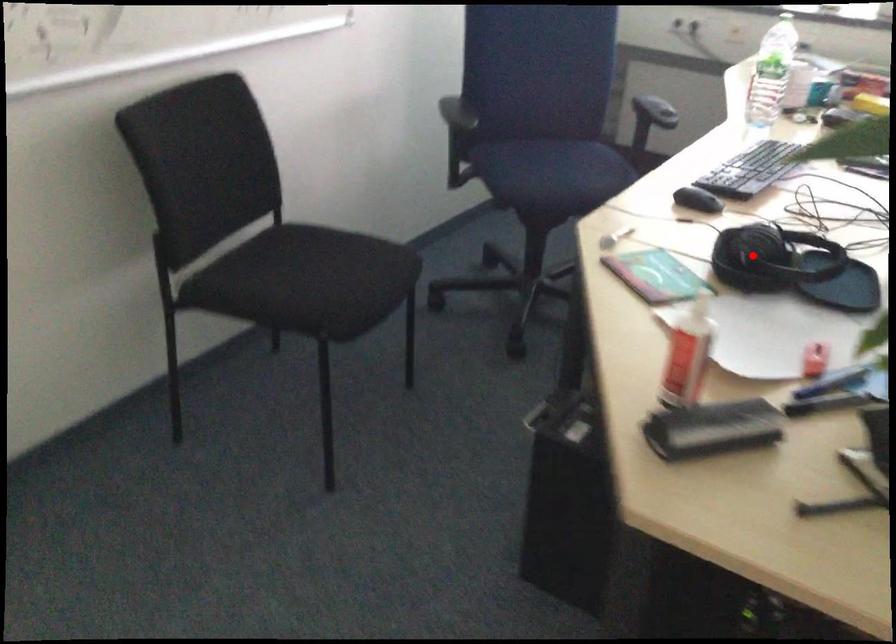
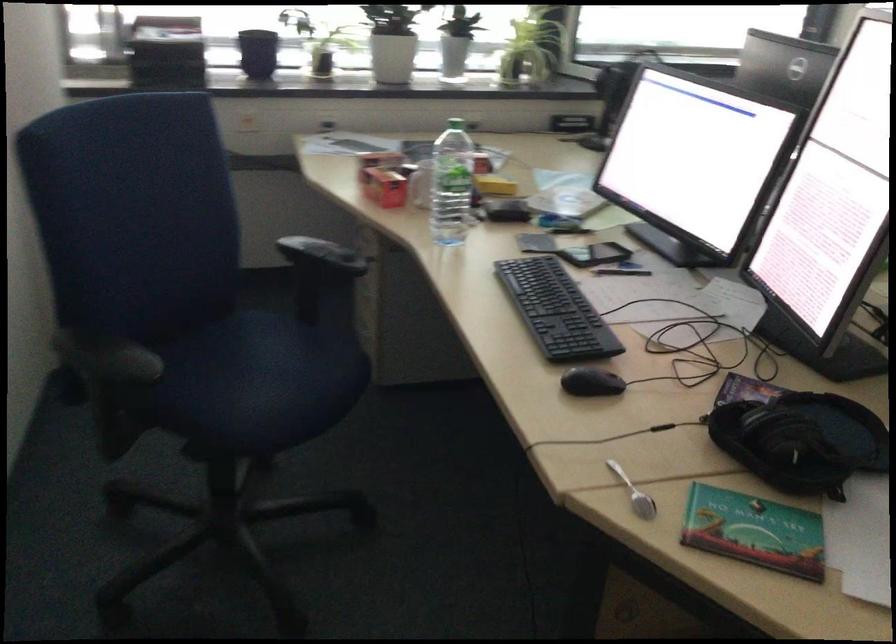
Question: I am providing you with two images of the same scene from different viewpoints. In image1, a red point is highlighted. Considering the same 3D point in image2, which of the following is correct?

Choices:
 (A) It is closer
 (B) It is farther

Answer: (A)